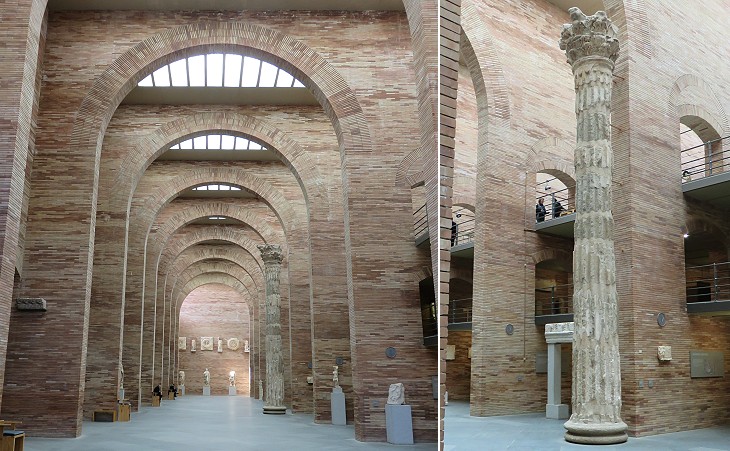
This screenshot has height=451, width=730. Find the location of `large pillar`. large pillar is located at coordinates (588, 243).